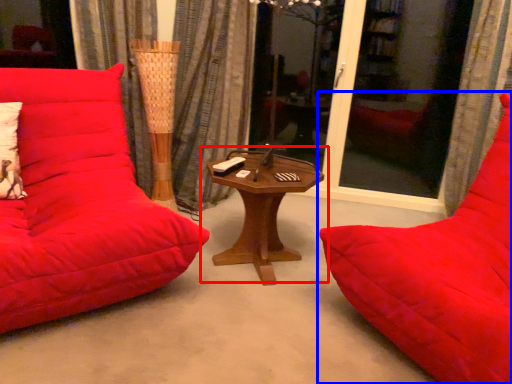
Question: Among these objects, which one is nearest to the camera, table (highlighted by a red box) or studio couch (highlighted by a blue box)?

Choices:
 (A) table
 (B) studio couch

Answer: (B)